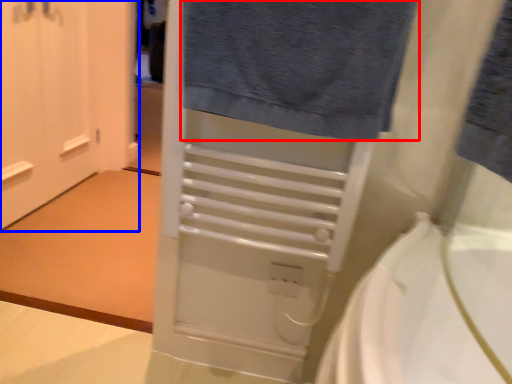
Question: Which object is closer to the camera taking this photo, towel (highlighted by a red box) or door (highlighted by a blue box)?

Choices:
 (A) towel
 (B) door

Answer: (A)